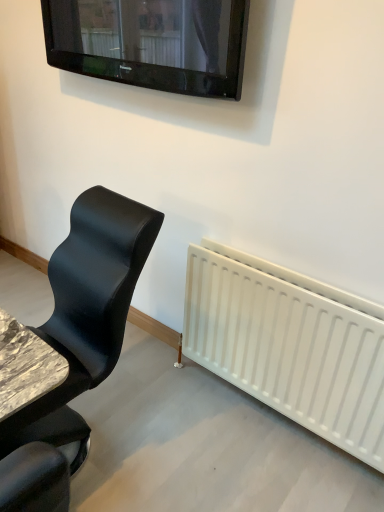
Question: In terms of height, does black glossy tv at upper center look taller or shorter compared to black leather chair at left?

Choices:
 (A) tall
 (B) short

Answer: (B)

Question: From a real-world perspective, is black glossy tv at upper center physically located above or below black leather chair at left?

Choices:
 (A) below
 (B) above

Answer: (B)

Question: In terms of size, does black glossy tv at upper center appear bigger or smaller than black leather chair at left?

Choices:
 (A) big
 (B) small

Answer: (B)

Question: From a real-world perspective, is black leather chair at left positioned above or below black glossy tv at upper center?

Choices:
 (A) above
 (B) below

Answer: (B)

Question: Based on their sizes in the image, would you say black leather chair at left is bigger or smaller than black glossy tv at upper center?

Choices:
 (A) big
 (B) small

Answer: (A)

Question: Considering the positions of point coord(97,321) and point coord(225,28), is point coord(97,321) closer or farther from the camera than point coord(225,28)?

Choices:
 (A) farther
 (B) closer

Answer: (B)

Question: From the image's perspective, is black leather chair at left above or below black glossy tv at upper center?

Choices:
 (A) below
 (B) above

Answer: (A)